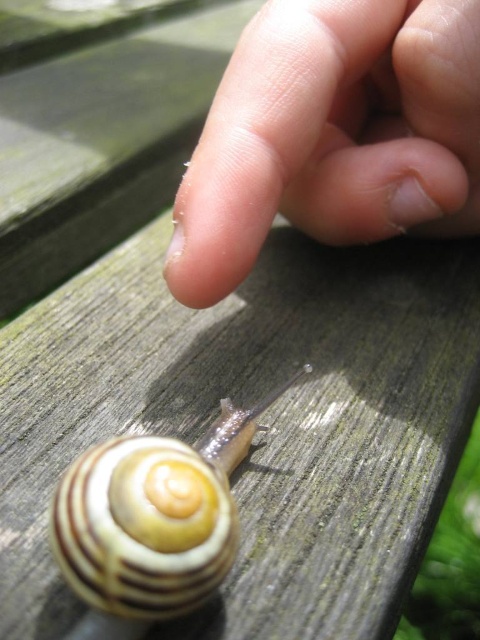
You are a biologist examining the snail and its environment. You notice a point marked at coordinates (333, 134). Based on the scene, what is located at this point?

The point at (333, 134) marks the pale skin at upper center.

You are an entomologist examining a closeup image of a snail on a wooden surface. You notice the pale skin at upper center and the striped shell snail at lower left. Which object is larger in size?

The pale skin at upper center is bigger than the striped shell snail at lower left.

You are an artist sketching this scene. You want to draw the pale skin at upper center precisely. Where should you place it on your grid paper using coordinates?

The pale skin at upper center should be placed at coordinates approximately 0.211 on the x axis and 0.694 on the y axis.